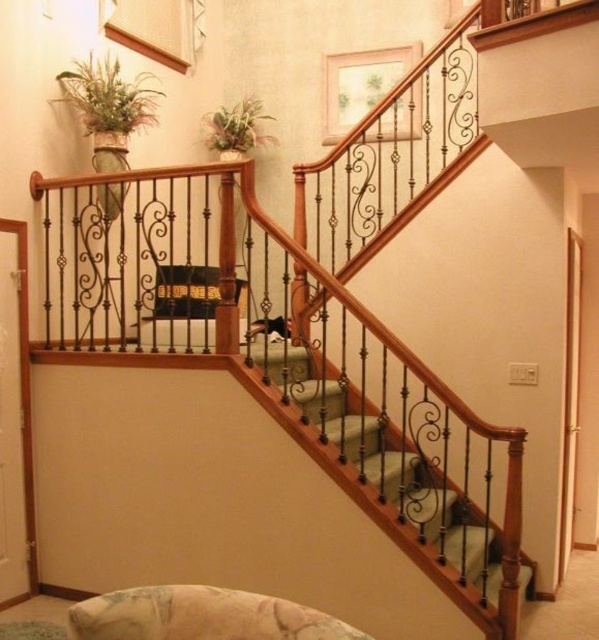
You are standing at the bottom of the staircase and looking up. You see the green matte plant at upper left and the green leafy plant at upper center. Which one appears closer to you?

The green matte plant at upper left appears closer to you because it is positioned in front of the green leafy plant at upper center.

You are standing at the origin point of the coordinate system in the image. You need to place a new plant exactly at the point where the green matte plant at upper left is currently located. What are the coordinates you should input into the placement tool to move the new plant there?

The coordinates for the green matte plant at upper left are at point (108, 97). Therefore, you should input 0.152 and 0.182 into the placement tool to move the new plant to that exact location.

You are a painter standing at the base of the staircase. You need to move a ladder between the wrought iron railing at center and the green matte plant at upper left. The ladder is 1.5 meters long. Will the space between them be sufficient for placing the ladder horizontally?

The distance between the wrought iron railing at center and the green matte plant at upper left is 1.31 meters. Since the ladder is 1.5 meters long, which is longer than the available space, the ladder cannot be placed horizontally between them.